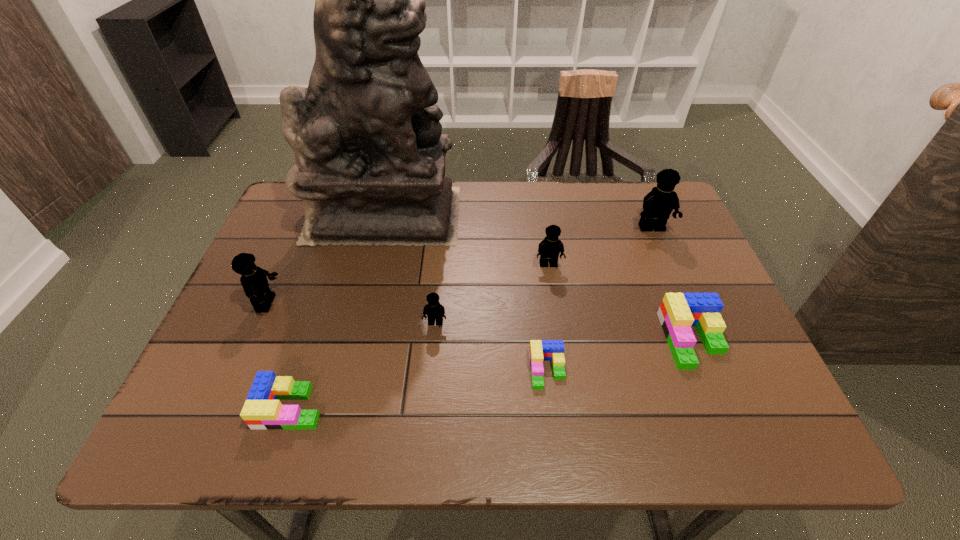
At what (x,y) coordinates should I click in order to perform the action: click on free point at the far edge. Please return your answer as a coordinate pair (x, y). The height and width of the screenshot is (540, 960). Looking at the image, I should click on click(539, 200).

The height and width of the screenshot is (540, 960). Find the location of `blank area at the near edge`. blank area at the near edge is located at coordinates (601, 431).

This screenshot has width=960, height=540. In the image, there is a desktop. Identify the location of vacant area at the left edge. (294, 336).

This screenshot has height=540, width=960. Find the location of `free space at the right edge`. free space at the right edge is located at coordinates (733, 367).

In the image, there is a desktop. Where is `vacant space at the far right corner`? vacant space at the far right corner is located at coordinates (621, 190).

Locate an element on the screen. This screenshot has width=960, height=540. unoccupied position between the third smallest yellow Lego and the seventh tallest object is located at coordinates (278, 355).

Find the location of a particular element. The height and width of the screenshot is (540, 960). free space between the second farthest yellow Lego and the sixth shortest Lego is located at coordinates (408, 284).

Locate an element on the screen. Image resolution: width=960 pixels, height=540 pixels. unoccupied position between the leftmost green Lego and the smallest yellow Lego is located at coordinates (363, 365).

Image resolution: width=960 pixels, height=540 pixels. What are the coordinates of `vacant area between the third smallest yellow Lego and the sixth tallest Lego` in the screenshot? It's located at (278, 355).

I want to click on free area in between the third yellow Lego from left to right and the fourth shortest object, so click(x=492, y=294).